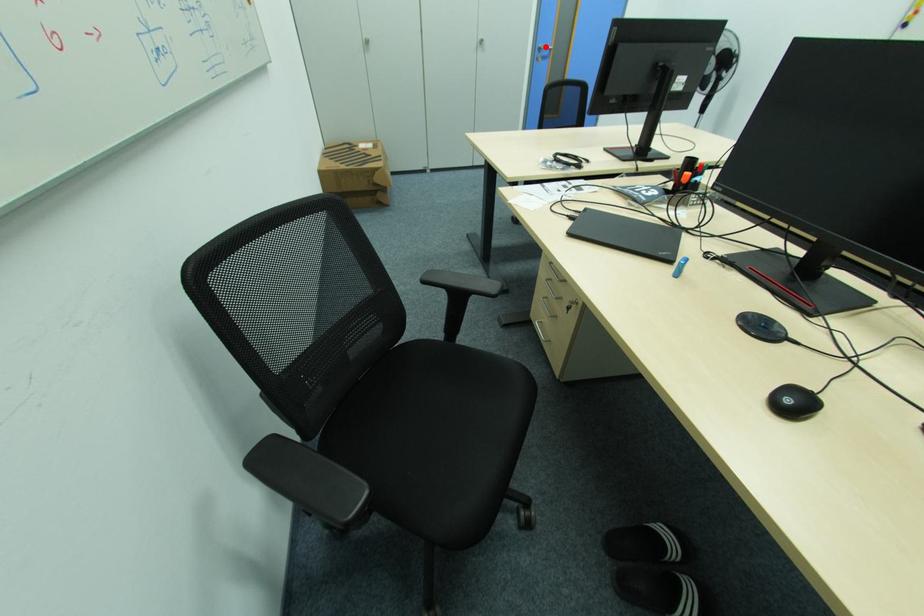
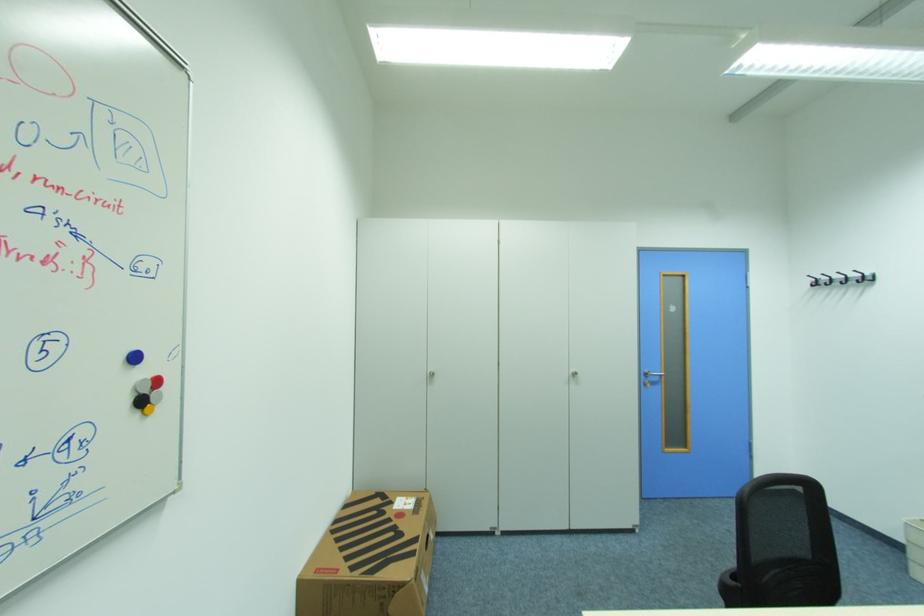
In the second image, find the point that corresponds to the highlighted location in the first image.

(651, 371)